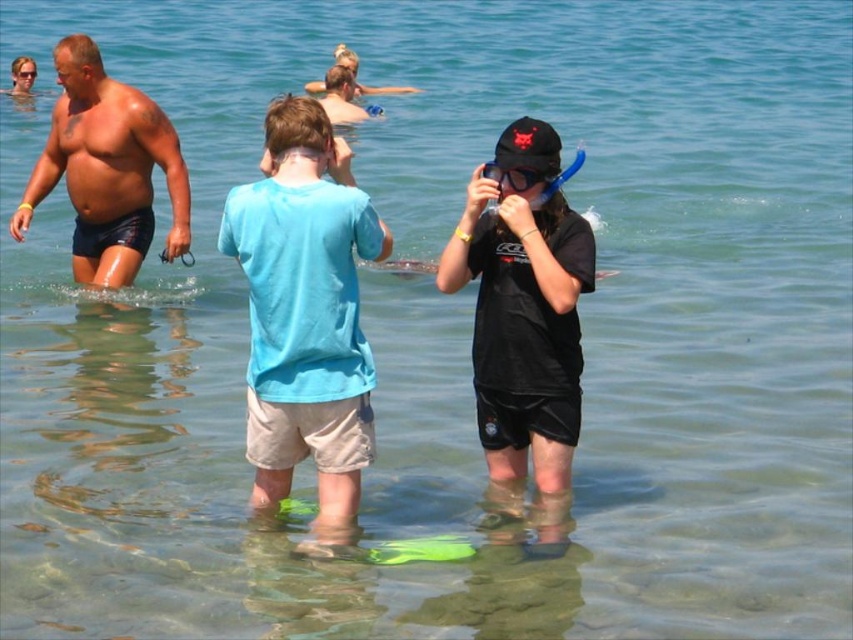
In the scene shown: Is black matte snorkel at center behind transparent rubber snorkel at center?

No, black matte snorkel at center is in front of transparent rubber snorkel at center.

Is point (473, 264) less distant than point (494, 176)?

No, (473, 264) is behind (494, 176).

Does point (538, 410) lie behind point (517, 170)?

Yes, it is behind point (517, 170).

The image size is (853, 640). Identify the location of black matte snorkel at center. (524, 339).

Can you confirm if light blue cotton shirt at center is positioned to the left of black matte snorkel at center?

Correct, you'll find light blue cotton shirt at center to the left of black matte snorkel at center.

The image size is (853, 640). I want to click on light blue cotton shirt at center, so click(x=305, y=312).

Which is behind, point (270, 260) or point (45, 172)?

Positioned behind is point (45, 172).

What do you see at coordinates (305, 312) in the screenshot? I see `light blue cotton shirt at center` at bounding box center [305, 312].

Image resolution: width=853 pixels, height=640 pixels. In order to click on light blue cotton shirt at center in this screenshot , I will do click(305, 312).

The height and width of the screenshot is (640, 853). Identify the location of light blue cotton shirt at center. (305, 312).